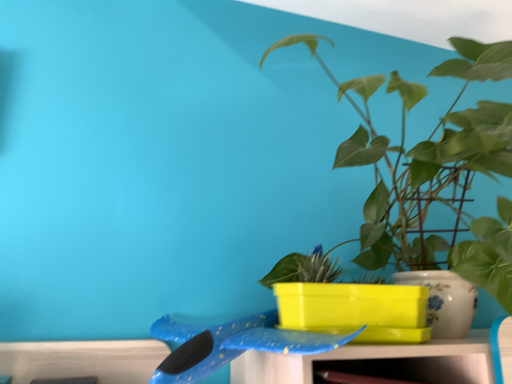
What do you see at coordinates (231, 344) in the screenshot? I see `blue glossy whale at center` at bounding box center [231, 344].

Find the location of a particular element. Image resolution: width=512 pixels, height=384 pixels. blue glossy whale at center is located at coordinates (231, 344).

Measure the distance between point (279, 339) and camera.

Point (279, 339) and camera are 25.00 inches apart.

Find the location of a particular element. The image size is (512, 384). green glossy plant at upper right is located at coordinates point(437,176).

This screenshot has height=384, width=512. Describe the element at coordinates (437, 176) in the screenshot. I see `green glossy plant at upper right` at that location.

I want to click on blue glossy whale at center, so click(231, 344).

Considering the relative positions of blue glossy whale at center and green glossy plant at upper right in the image provided, is blue glossy whale at center to the left of green glossy plant at upper right from the viewer's perspective?

Yes.

Relative to green glossy plant at upper right, is blue glossy whale at center in front or behind?

Visually, blue glossy whale at center is located behind green glossy plant at upper right.

Is point (202, 357) farther from viewer compared to point (505, 214)?

No.

In the scene shown: From the image's perspective, is blue glossy whale at center above or below green glossy plant at upper right?

Clearly, from the image's perspective, blue glossy whale at center is below green glossy plant at upper right.

From a real-world perspective, who is located lower, blue glossy whale at center or green glossy plant at upper right?

blue glossy whale at center is physically lower.

Considering the sizes of objects blue glossy whale at center and green glossy plant at upper right in the image provided, who is thinner, blue glossy whale at center or green glossy plant at upper right?

With smaller width is blue glossy whale at center.

Consider the image. Considering the sizes of blue glossy whale at center and green glossy plant at upper right in the image, is blue glossy whale at center taller or shorter than green glossy plant at upper right?

Clearly, blue glossy whale at center is shorter compared to green glossy plant at upper right.

Considering the relative sizes of blue glossy whale at center and green glossy plant at upper right in the image provided, is blue glossy whale at center bigger than green glossy plant at upper right?

No.

Is blue glossy whale at center completely or partially outside of green glossy plant at upper right?

Yes.

Is blue glossy whale at center far away from green glossy plant at upper right?

No, blue glossy whale at center is not far away from green glossy plant at upper right.

Is blue glossy whale at center facing away from green glossy plant at upper right?

That's not correct — blue glossy whale at center is not looking away from green glossy plant at upper right.

How many degrees apart are the facing directions of blue glossy whale at center and green glossy plant at upper right?

The angular difference between blue glossy whale at center and green glossy plant at upper right is 9.18e-05 degrees.

How far apart are blue glossy whale at center and green glossy plant at upper right?

blue glossy whale at center and green glossy plant at upper right are 13.48 inches apart from each other.

This screenshot has height=384, width=512. I want to click on houseplant above the blue glossy whale at center (from the image's perspective), so click(437, 176).

Considering the relative positions of green glossy plant at upper right and blue glossy whale at center in the image provided, is green glossy plant at upper right to the left or to the right of blue glossy whale at center?

green glossy plant at upper right is positioned on blue glossy whale at center's right side.

Which is behind, green glossy plant at upper right or blue glossy whale at center?

blue glossy whale at center.

Which is further, [400,179] or [176,363]?

Positioned behind is point [400,179].

From the image's perspective, would you say green glossy plant at upper right is shown under blue glossy whale at center?

No, from the image's perspective, green glossy plant at upper right is not beneath blue glossy whale at center.

From a real-world perspective, relative to blue glossy whale at center, is green glossy plant at upper right vertically above or below?

green glossy plant at upper right is situated higher than blue glossy whale at center in the real world.

Which of these two, green glossy plant at upper right or blue glossy whale at center, is wider?

With larger width is green glossy plant at upper right.

Considering the sizes of objects green glossy plant at upper right and blue glossy whale at center in the image provided, who is taller, green glossy plant at upper right or blue glossy whale at center?

green glossy plant at upper right.

Can you confirm if green glossy plant at upper right is bigger than blue glossy whale at center?

Correct, green glossy plant at upper right is larger in size than blue glossy whale at center.

Would you say green glossy plant at upper right contains blue glossy whale at center?

No, blue glossy whale at center is not surrounded by green glossy plant at upper right.

Is green glossy plant at upper right positioned far away from blue glossy whale at center?

green glossy plant at upper right is actually quite close to blue glossy whale at center.

Is green glossy plant at upper right turned away from blue glossy whale at center?

No.

How different are the orientations of green glossy plant at upper right and blue glossy whale at center in degrees?

9.18e-05 degrees.

Identify the location of whale behind the green glossy plant at upper right. (231, 344).

Locate an element on the screen. houseplant on the right of blue glossy whale at center is located at coordinates [437, 176].

Where is `whale located below the green glossy plant at upper right (from the image's perspective)`? This screenshot has height=384, width=512. whale located below the green glossy plant at upper right (from the image's perspective) is located at coordinates (231, 344).